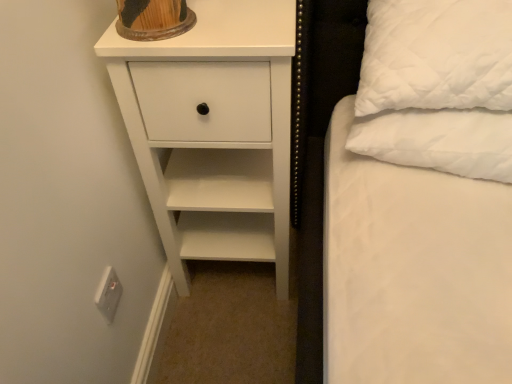
Question: Could white matte chest of drawers at upper left be considered to be inside white plastic electric outlet at lower left?

Choices:
 (A) no
 (B) yes

Answer: (A)

Question: Considering the relative sizes of white plastic electric outlet at lower left and white matte chest of drawers at upper left in the image provided, is white plastic electric outlet at lower left smaller than white matte chest of drawers at upper left?

Choices:
 (A) no
 (B) yes

Answer: (B)

Question: Is the depth of white plastic electric outlet at lower left less than that of white matte chest of drawers at upper left?

Choices:
 (A) no
 (B) yes

Answer: (A)

Question: Is white plastic electric outlet at lower left shorter than white matte chest of drawers at upper left?

Choices:
 (A) yes
 (B) no

Answer: (A)

Question: Can you confirm if white plastic electric outlet at lower left is bigger than white matte chest of drawers at upper left?

Choices:
 (A) no
 (B) yes

Answer: (A)

Question: Is white matte chest of drawers at upper left situated inside white plastic electric outlet at lower left or outside?

Choices:
 (A) outside
 (B) inside

Answer: (A)

Question: From a real-world perspective, is white matte chest of drawers at upper left physically located above or below white plastic electric outlet at lower left?

Choices:
 (A) below
 (B) above

Answer: (B)

Question: Considering the positions of white matte chest of drawers at upper left and white plastic electric outlet at lower left in the image, is white matte chest of drawers at upper left taller or shorter than white plastic electric outlet at lower left?

Choices:
 (A) short
 (B) tall

Answer: (B)

Question: Is white matte chest of drawers at upper left wider or thinner than white plastic electric outlet at lower left?

Choices:
 (A) thin
 (B) wide

Answer: (B)

Question: From a real-world perspective, is white plastic electric outlet at lower left physically located above or below white matte chest of drawers at upper left?

Choices:
 (A) above
 (B) below

Answer: (B)

Question: Choose the correct answer: Is white plastic electric outlet at lower left inside white matte chest of drawers at upper left or outside it?

Choices:
 (A) outside
 (B) inside

Answer: (A)

Question: Is white plastic electric outlet at lower left in front of or behind white matte chest of drawers at upper left in the image?

Choices:
 (A) front
 (B) behind

Answer: (B)

Question: Considering the relative positions of white plastic electric outlet at lower left and white matte chest of drawers at upper left in the image provided, is white plastic electric outlet at lower left to the left or to the right of white matte chest of drawers at upper left?

Choices:
 (A) right
 (B) left

Answer: (B)

Question: Is white quilted pillow at right taller or shorter than white matte chest of drawers at upper left?

Choices:
 (A) short
 (B) tall

Answer: (A)

Question: In terms of width, does white quilted pillow at right look wider or thinner when compared to white matte chest of drawers at upper left?

Choices:
 (A) thin
 (B) wide

Answer: (A)